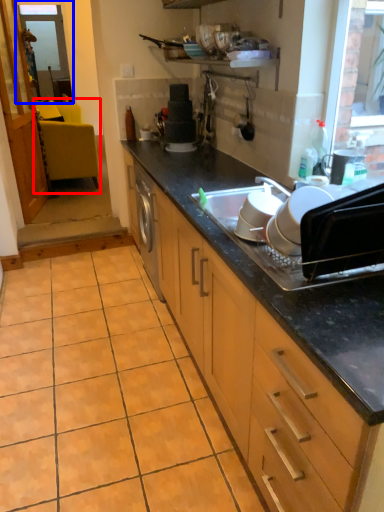
Question: Which object appears farthest to the camera in this image, chair (highlighted by a red box) or window screen (highlighted by a blue box)?

Choices:
 (A) chair
 (B) window screen

Answer: (B)